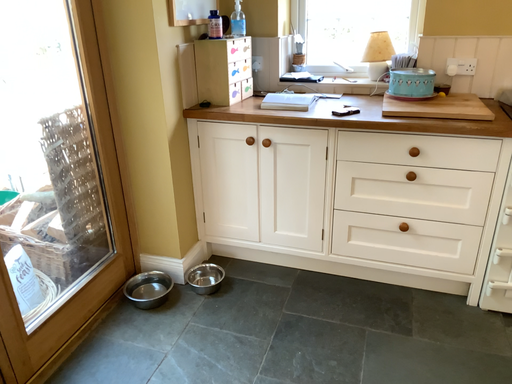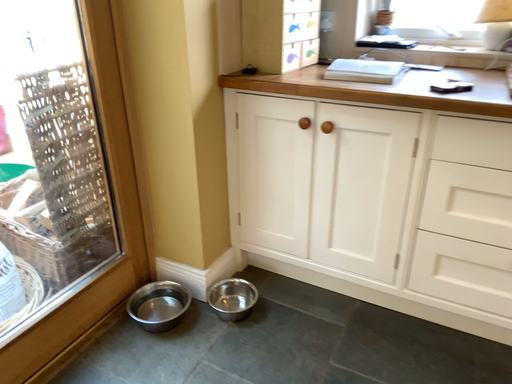
Question: Which way did the camera rotate in the video?

Choices:
 (A) rotated right
 (B) rotated left

Answer: (B)